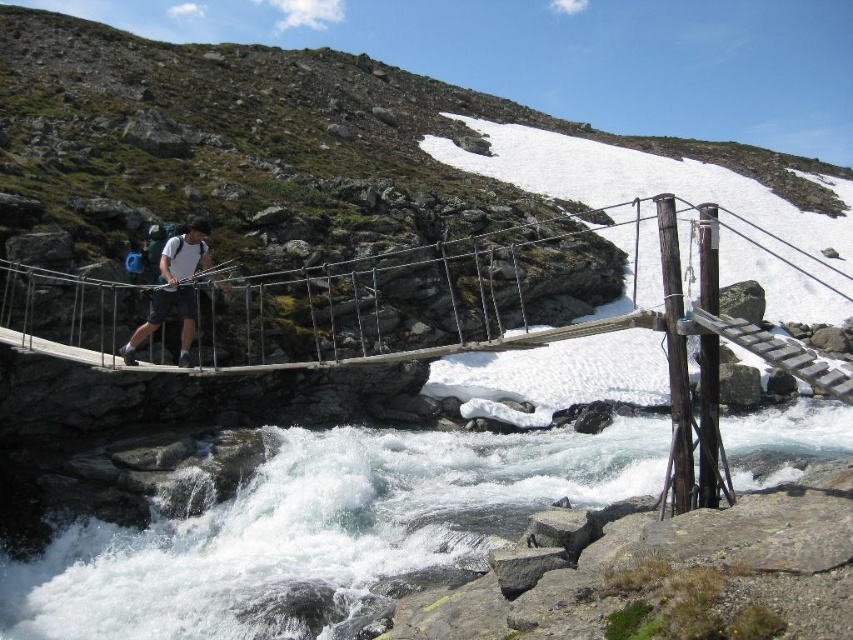
Looking at this image, you are a hiker standing on the suspension bridge and notice the white frothy water at lower center and the matte white shirt at center. Which object is closer to the bridge?

The white frothy water at lower center is closer to the bridge because it is shorter than the matte white shirt at center, which is further away.

You are a hiker planning to cross the wooden suspension bridge at center. You notice the white frothy water at lower center below the bridge. From your position on the bridge, which object is closer to you?

The white frothy water at lower center is closer to you than the wooden suspension bridge at center because it is positioned further to the viewer.

You are a hiker who wants to cross the suspension bridge in the image. The bridge is located above a fast flowing river. You need to know where the white frothy water at lower center is located relative to the bridge. Is it directly below the bridge or to the side?

The white frothy water at lower center is located at point (321, 534), which means it is directly below the bridge.